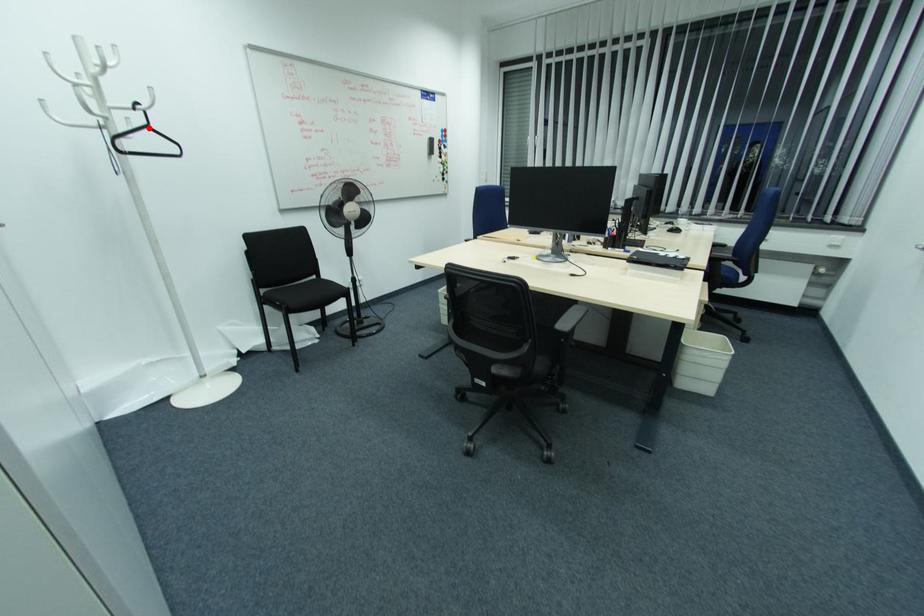
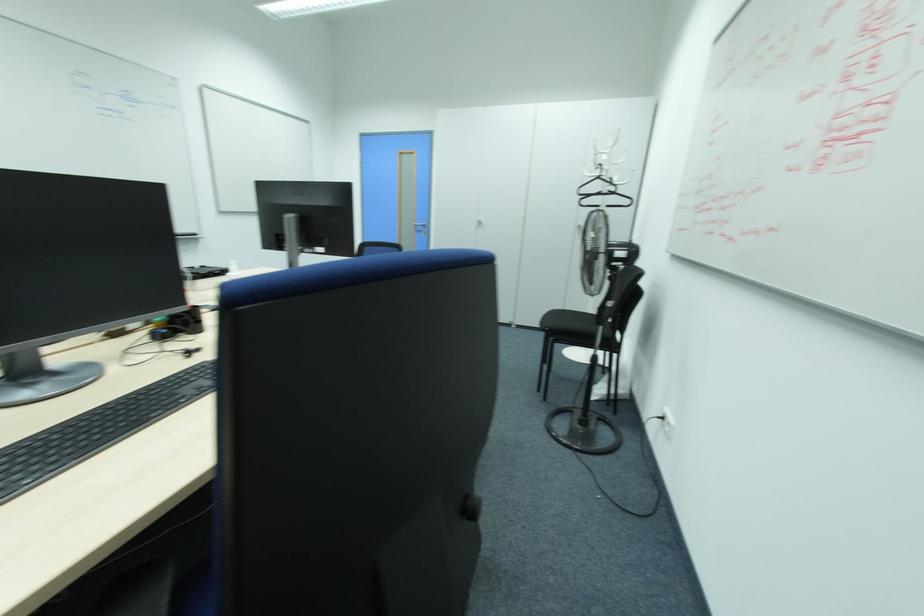
Question: A red point is marked in image1. In image2, is the corresponding 3D point closer to the camera or farther? Reply with the corresponding letter.

Choices:
 (A) The corresponding 3D point is closer.
 (B) The corresponding 3D point is farther.

Answer: (A)